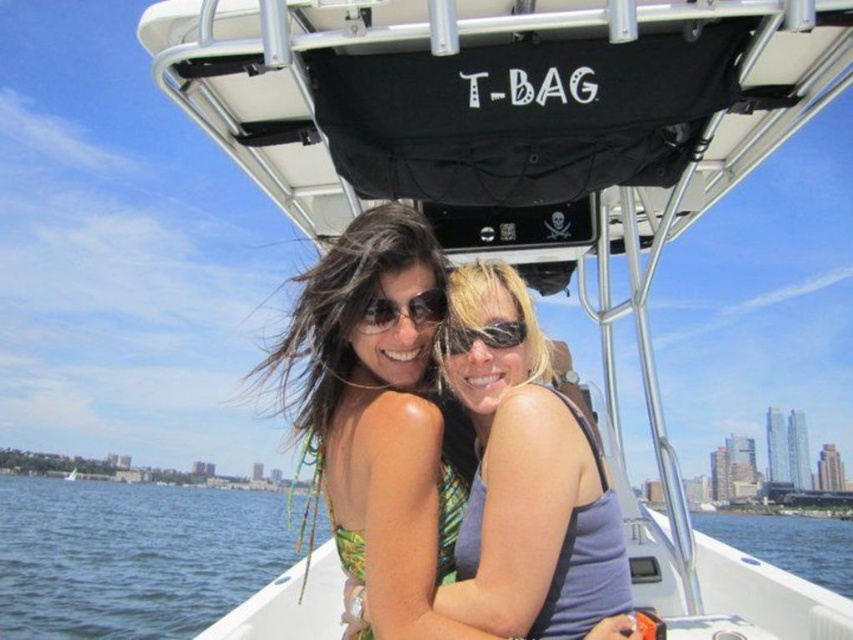
Between point (490, 477) and point (436, 346), which one is positioned in front?

Positioned in front is point (490, 477).

Which is more to the right, purple matte tank top at center or black reflective sunglasses at center?

Positioned to the right is purple matte tank top at center.

You are a GUI agent. You are given a task and a screenshot of the screen. Output one action in this format:
    pyautogui.click(x=<x>, y=<y>)
    Task: Click on the purple matte tank top at center
    
    Given the screenshot: What is the action you would take?
    pyautogui.click(x=527, y=483)

Find the location of a particular element. The width and height of the screenshot is (853, 640). purple matte tank top at center is located at coordinates (527, 483).

Between green fabric bikini top at center and black reflective sunglasses at center, which one is positioned lower?

green fabric bikini top at center is below.

Between point (357, 486) and point (451, 353), which one is positioned in front?

Point (357, 486) is in front.

Locate an element on the screen. The width and height of the screenshot is (853, 640). green fabric bikini top at center is located at coordinates (381, 420).

You are a GUI agent. You are given a task and a screenshot of the screen. Output one action in this format:
    pyautogui.click(x=<x>, y=<y>)
    Task: Click on the green fabric bikini top at center
    This screenshot has width=853, height=640.
    Given the screenshot: What is the action you would take?
    pyautogui.click(x=381, y=420)

Is green fabric bikini top at center shorter than sunglasses at center?

Incorrect, green fabric bikini top at center's height does not fall short of sunglasses at center's.

The height and width of the screenshot is (640, 853). What are the coordinates of `green fabric bikini top at center` in the screenshot? It's located at (381, 420).